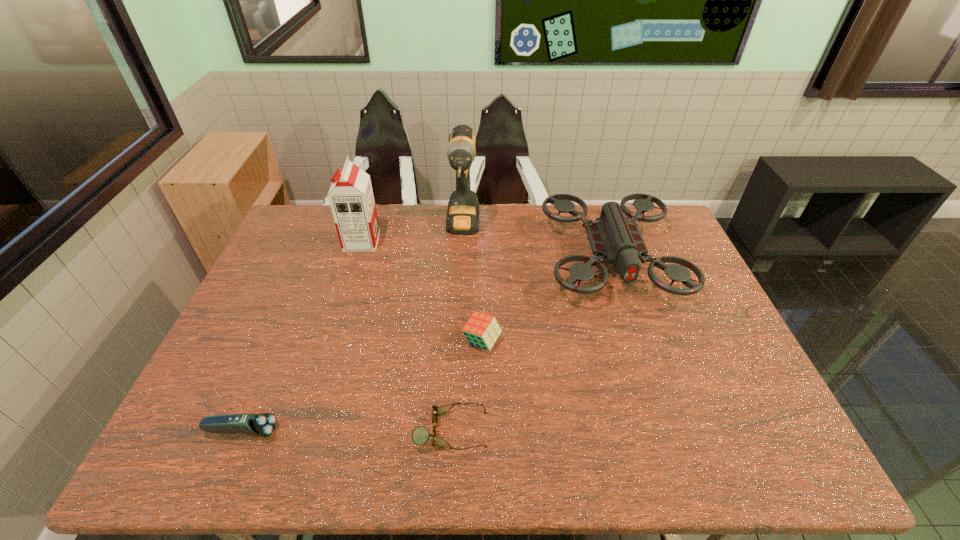
Find the location of a particular element. unoccupied position between the shortest object and the second shortest object is located at coordinates (347, 430).

Image resolution: width=960 pixels, height=540 pixels. I want to click on free space that is in between the third shortest object and the spectacles, so click(x=467, y=386).

Locate an element on the screen. The height and width of the screenshot is (540, 960). free space between the third tallest object and the drill is located at coordinates (537, 242).

The image size is (960, 540). I want to click on free space between the soya milk and the third shortest object, so click(421, 292).

Locate an element on the screen. The width and height of the screenshot is (960, 540). free spot between the drill and the fourth tallest object is located at coordinates (472, 285).

At what (x,y) coordinates should I click in order to perform the action: click on vacant region between the second shortest object and the drill. Please return your answer as a coordinate pair (x, y). The height and width of the screenshot is (540, 960). Looking at the image, I should click on (352, 329).

Find the location of a particular element. The width and height of the screenshot is (960, 540). vacant area that lies between the fourth tallest object and the soya milk is located at coordinates (421, 292).

Choose which object is the fourth nearest neighbor to the electric shaver. Please provide its 2D coordinates. Your answer should be formatted as a tuple, i.e. [(x, y)], where the tuple contains the x and y coordinates of a point satisfying the conditions above.

[(462, 218)]

Identify which object is located as the third nearest to the third tallest object. Please provide its 2D coordinates. Your answer should be formatted as a tuple, i.e. [(x, y)], where the tuple contains the x and y coordinates of a point satisfying the conditions above.

[(420, 435)]

At what (x,y) coordinates should I click in order to perform the action: click on vacant area that satisfies the following two spatial constraints: 1. on the front-facing side of the rightmost object; 2. on the front-facing side of the shortest object. Please return your answer as a coordinate pair (x, y). The image size is (960, 540). Looking at the image, I should click on (667, 430).